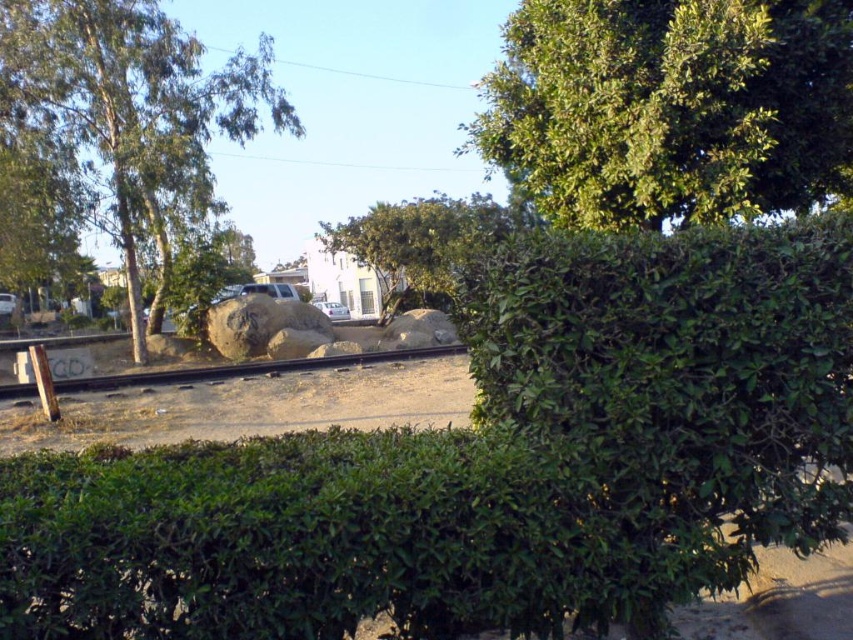
Question: Considering the relative positions of green leafy hedge at center and brown dirt track at center in the image provided, where is green leafy hedge at center located with respect to brown dirt track at center?

Choices:
 (A) below
 (B) above

Answer: (B)

Question: Among these objects, which one is farthest from the camera?

Choices:
 (A) white matte car at center
 (B) brown dirt track at center
 (C) green leafy tree at upper right
 (D) green leafy hedge at center

Answer: (A)

Question: Based on their relative distances, which object is nearer to the brown dirt track at center?

Choices:
 (A) green leafy tree at upper right
 (B) brown rough boulder at center
 (C) green leafy hedge at center

Answer: (A)

Question: Is green leafy tree at center above smooth metal train track at center?

Choices:
 (A) no
 (B) yes

Answer: (B)

Question: Which of the following is the farthest from the observer?

Choices:
 (A) (627, 68)
 (B) (343, 305)
 (C) (492, 240)
 (D) (660, 611)

Answer: (B)

Question: Can you confirm if brown dirt track at center is wider than green leafy tree at center?

Choices:
 (A) yes
 (B) no

Answer: (B)